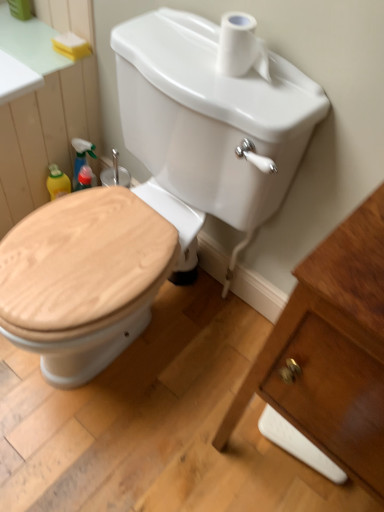
Find the location of `vacant area in front of wooden toilet seat at center`. vacant area in front of wooden toilet seat at center is located at coordinates (116, 452).